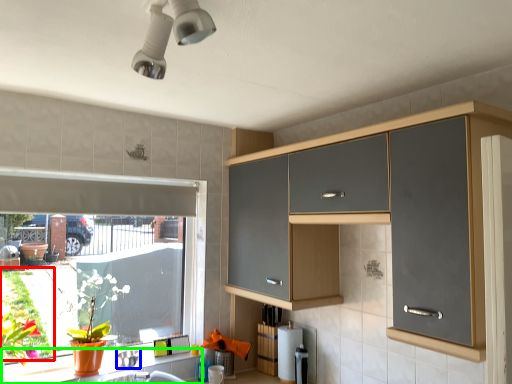
Question: Considering the real-world distances, which object is farthest from plant (highlighted by a red box)? appliance (highlighted by a blue box) or counter (highlighted by a green box)?

Choices:
 (A) appliance
 (B) counter

Answer: (A)